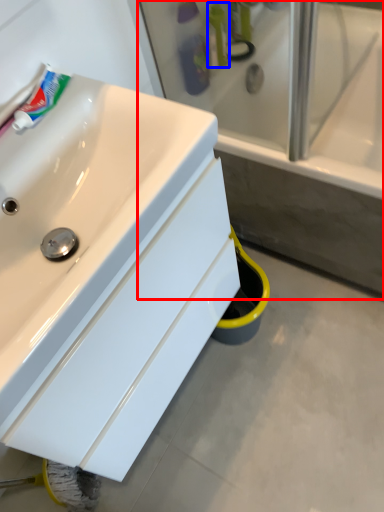
Question: Which point is further to the camera, bathtub (highlighted by a red box) or mouthwash (highlighted by a blue box)?

Choices:
 (A) bathtub
 (B) mouthwash

Answer: (B)